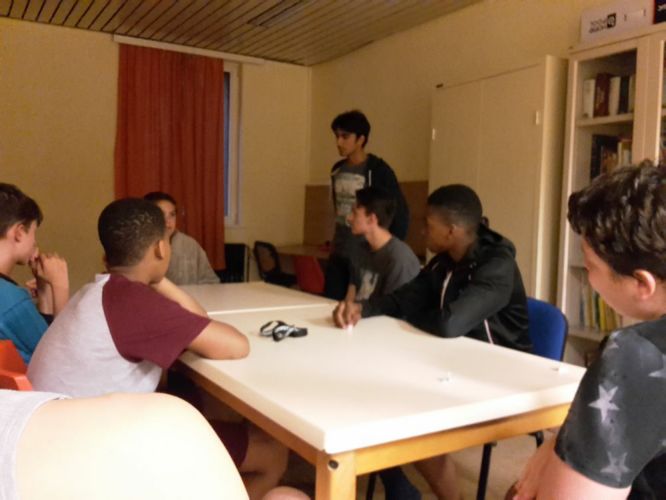
Locate an element on the screen. The height and width of the screenshot is (500, 666). tableleg is located at coordinates (341, 492).